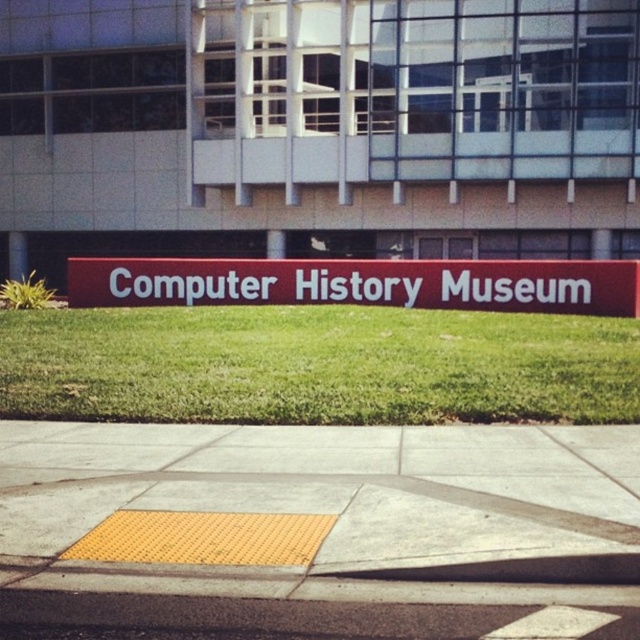
Based on the photo, you are planning to place a large statue that requires a 3x3 meter base on the yellow textured pavement at center and the red matte sign at center. Based on the size of the objects, which location would be suitable for placing the statue?

The red matte sign at center has a larger size compared to the yellow textured pavement at center, so the statue can be placed on the red matte sign at center since it can accommodate the 3x3 meter base.

You are standing at the entrance of the Computer History Museum and want to find the yellow textured pavement at center. According to the coordinates provided, where should you look to locate it?

The yellow textured pavement at center is located at coordinates point (332, 529).